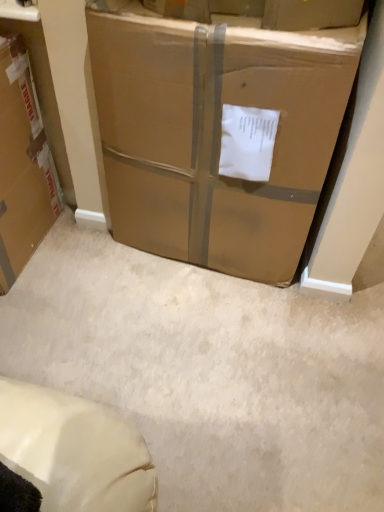
Question: Considering the positions of point (29, 151) and point (96, 6), is point (29, 151) closer or farther from the camera than point (96, 6)?

Choices:
 (A) closer
 (B) farther

Answer: (B)

Question: In the image, is brown cardboard box at left, placed as the 2th box when sorted from right to left, positioned in front of or behind brown cardboard box at center, the 2th box in the left-to-right sequence?

Choices:
 (A) behind
 (B) front

Answer: (A)

Question: Based on their positions, is brown cardboard box at left, placed as the first box when sorted from left to right, located to the left or right of brown cardboard box at center, which is the 1th box in right-to-left order?

Choices:
 (A) left
 (B) right

Answer: (A)

Question: Is brown cardboard box at center, which is the 1th box in right-to-left order, taller or shorter than brown cardboard box at left, placed as the first box when sorted from left to right?

Choices:
 (A) tall
 (B) short

Answer: (A)

Question: In the image, is brown cardboard box at center, the 2th box in the left-to-right sequence, on the left side or the right side of brown cardboard box at left, placed as the first box when sorted from left to right?

Choices:
 (A) left
 (B) right

Answer: (B)

Question: Considering their positions, is brown cardboard box at center, the 2th box in the left-to-right sequence, located in front of or behind brown cardboard box at left, placed as the first box when sorted from left to right?

Choices:
 (A) behind
 (B) front

Answer: (B)

Question: Considering the positions of point (220, 90) and point (19, 39), is point (220, 90) closer or farther from the camera than point (19, 39)?

Choices:
 (A) closer
 (B) farther

Answer: (A)